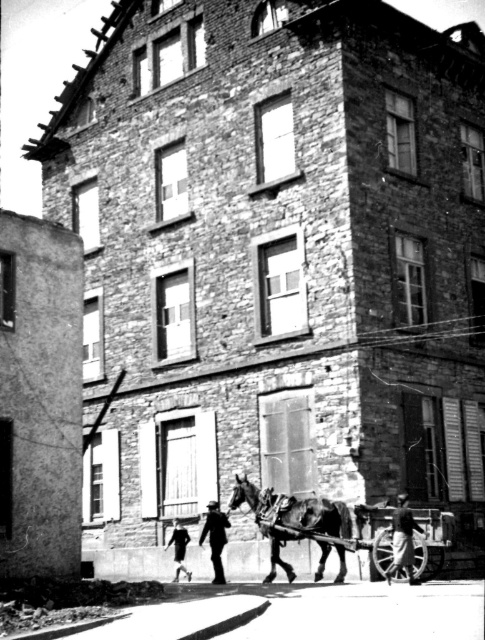
You are standing at the entrance of the multi story brick building and want to reach the smooth wooden cart at lower center. The distance between them is 124.42 feet. If you walk at a speed of 3 feet per second, how many seconds will it take you to reach the cart?

The distance between the entrance of the multi story brick building and the smooth wooden cart at lower center is 124.42 feet. At a walking speed of 3 feet per second, it would take approximately 41.47 seconds to reach the cart.

In the historical scene, there is a multi story brick building with boarded up windows and a horse drawn cart. You see a point at coordinate (403, 540). What object is located at that point?

The point at coordinate (403, 540) corresponds to the dark gray fabric coat at lower right.